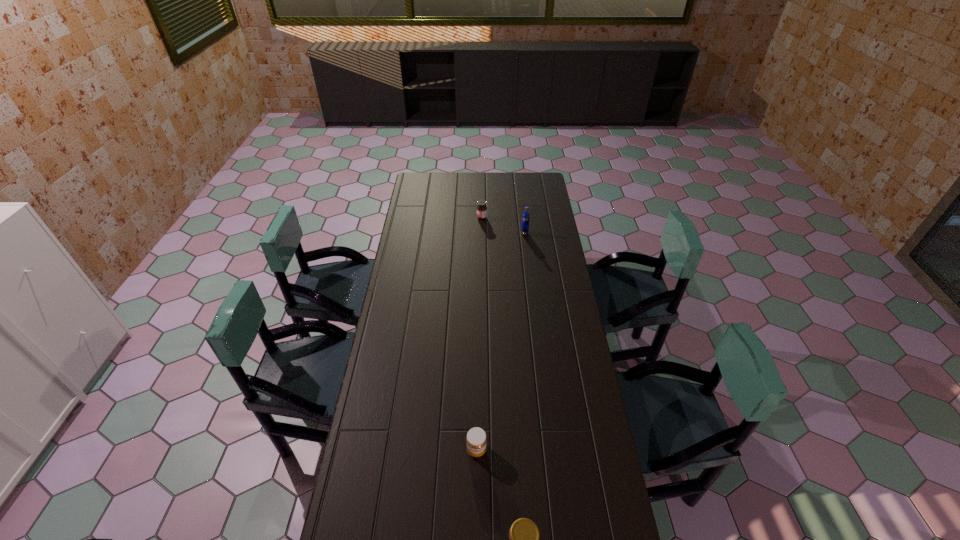
Find the location of a particular element. The height and width of the screenshot is (540, 960). object that is the third closest to the farthest jam is located at coordinates (524, 539).

Select which jam is the closest to the farthest jam. Please provide its 2D coordinates. Your answer should be formatted as a tuple, i.e. [(x, y)], where the tuple contains the x and y coordinates of a point satisfying the conditions above.

[(476, 439)]

Where is `the closest jam relative to the farthest object`? the closest jam relative to the farthest object is located at coordinates (476, 439).

Locate an element on the screen. The image size is (960, 540). vacant position in the image that satisfies the following two spatial constraints: 1. on the label side of the farthest object; 2. on the left side of the tallest object is located at coordinates (482, 233).